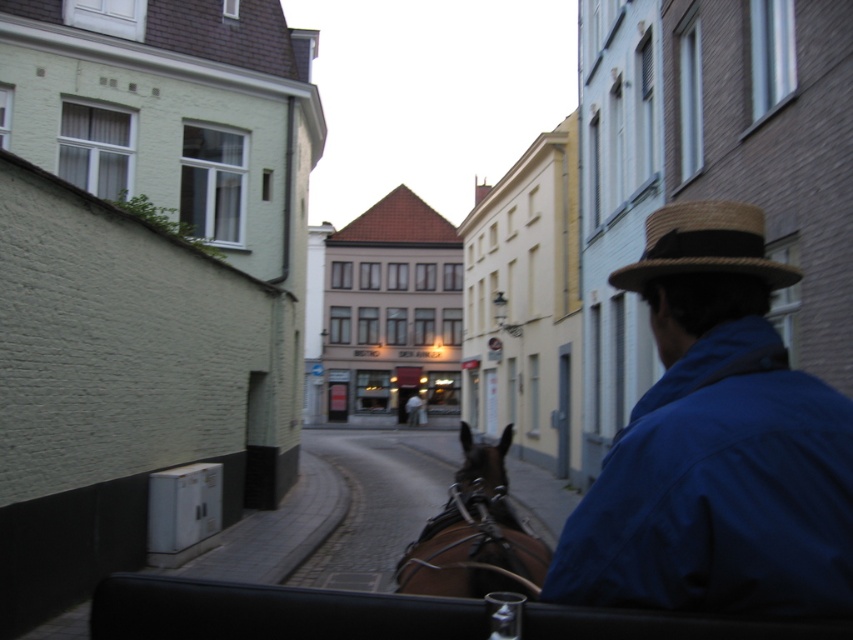
Question: Which of the following is the farthest from the observer?

Choices:
 (A) (790, 275)
 (B) (514, 536)

Answer: (B)

Question: Does blue cotton jacket at right appear over natural straw hat at upper right?

Choices:
 (A) no
 (B) yes

Answer: (A)

Question: Which object appears farthest from the camera in this image?

Choices:
 (A) natural straw hat at upper right
 (B) blue cotton jacket at right

Answer: (A)

Question: Can you confirm if blue cotton jacket at right is wider than brown leather horse at center?

Choices:
 (A) yes
 (B) no

Answer: (B)

Question: Estimate the real-world distances between objects in this image. Which object is farther from the brown leather horse at center?

Choices:
 (A) blue cotton jacket at right
 (B) natural straw hat at upper right

Answer: (B)

Question: Does blue cotton jacket at right appear over natural straw hat at upper right?

Choices:
 (A) yes
 (B) no

Answer: (B)